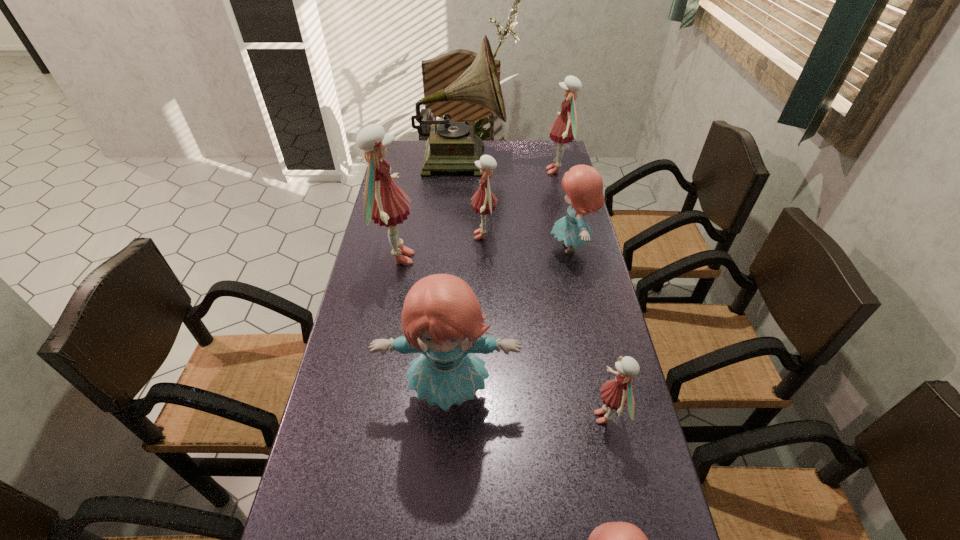
I want to click on object that is the nearest to the second smallest blue doll, so click(x=485, y=202).

Point out which object is positioned as the second nearest to the biggest pink doll. Please provide its 2D coordinates. Your answer should be formatted as a tuple, i.e. [(x, y)], where the tuple contains the x and y coordinates of a point satisfying the conditions above.

[(441, 318)]

Identify which doll is the sixth nearest to the third pink doll from right to left. Please provide its 2D coordinates. Your answer should be formatted as a tuple, i.e. [(x, y)], where the tuple contains the x and y coordinates of a point satisfying the conditions above.

[(612, 539)]

Where is `doll identified as the third closest to the second smallest pink doll`? doll identified as the third closest to the second smallest pink doll is located at coordinates (564, 130).

This screenshot has width=960, height=540. Find the location of `pink doll that is the fourth nearest to the second biggest blue doll`. pink doll that is the fourth nearest to the second biggest blue doll is located at coordinates (384, 203).

Identify which pink doll is located as the second nearest to the nearest pink doll. Please provide its 2D coordinates. Your answer should be formatted as a tuple, i.e. [(x, y)], where the tuple contains the x and y coordinates of a point satisfying the conditions above.

[(384, 203)]

Locate which blue doll ranks in proximity to the nearest object. Please provide its 2D coordinates. Your answer should be formatted as a tuple, i.e. [(x, y)], where the tuple contains the x and y coordinates of a point satisfying the conditions above.

[(441, 318)]

Where is `the second closest blue doll to the nearest pink doll`? The image size is (960, 540). the second closest blue doll to the nearest pink doll is located at coordinates (612, 539).

Locate an element on the screen. The image size is (960, 540). vacant region that satisfies the following two spatial constraints: 1. on the front-facing side of the farthest blue doll; 2. on the front-facing side of the second nearest blue doll is located at coordinates tap(602, 393).